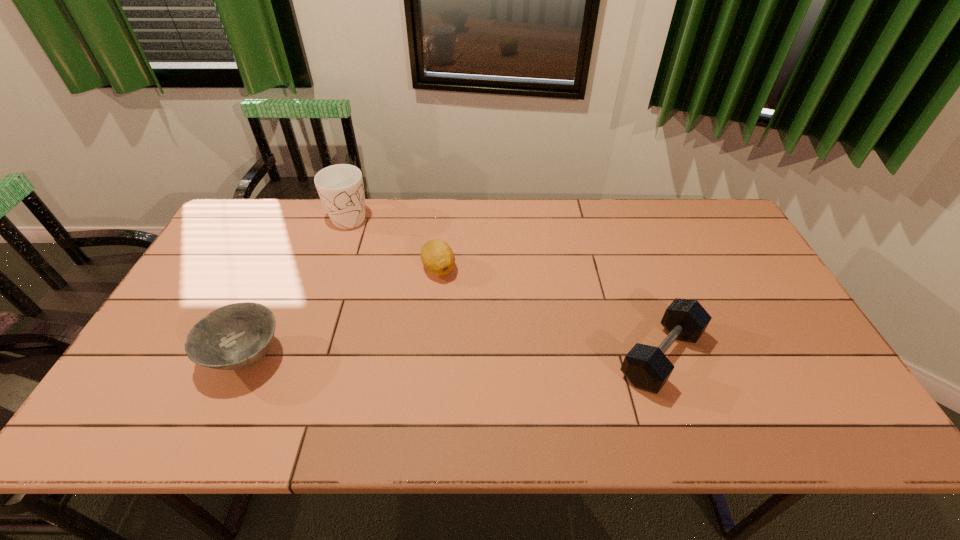
In the image, there is a desktop. What are the coordinates of `vacant space at the near edge` in the screenshot? It's located at (750, 397).

In the image, there is a desktop. Where is `vacant space at the right edge`? vacant space at the right edge is located at coordinates (720, 245).

Locate an element on the screen. Image resolution: width=960 pixels, height=540 pixels. free region at the far left corner of the desktop is located at coordinates (241, 214).

I want to click on vacant space at the near left corner, so click(x=153, y=395).

The width and height of the screenshot is (960, 540). I want to click on free space at the far right corner of the desktop, so click(x=675, y=199).

Find the location of `vacant region at the near right corner of the desktop`. vacant region at the near right corner of the desktop is located at coordinates (763, 368).

Locate an element on the screen. unoccupied area between the tallest object and the bowl is located at coordinates (299, 286).

Find the location of a particular element. free space that is in between the dumbbell and the mug is located at coordinates coord(506,286).

Identify the location of free spot between the rightmost object and the mug. (506, 286).

Where is `free space between the tallest object and the bowl`? The height and width of the screenshot is (540, 960). free space between the tallest object and the bowl is located at coordinates (299, 286).